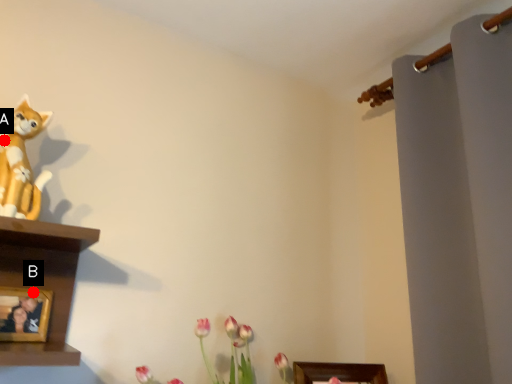
Question: Two points are circled on the image, labeled by A and B beside each circle. Which point is closer to the camera?

Choices:
 (A) A is closer
 (B) B is closer

Answer: (A)